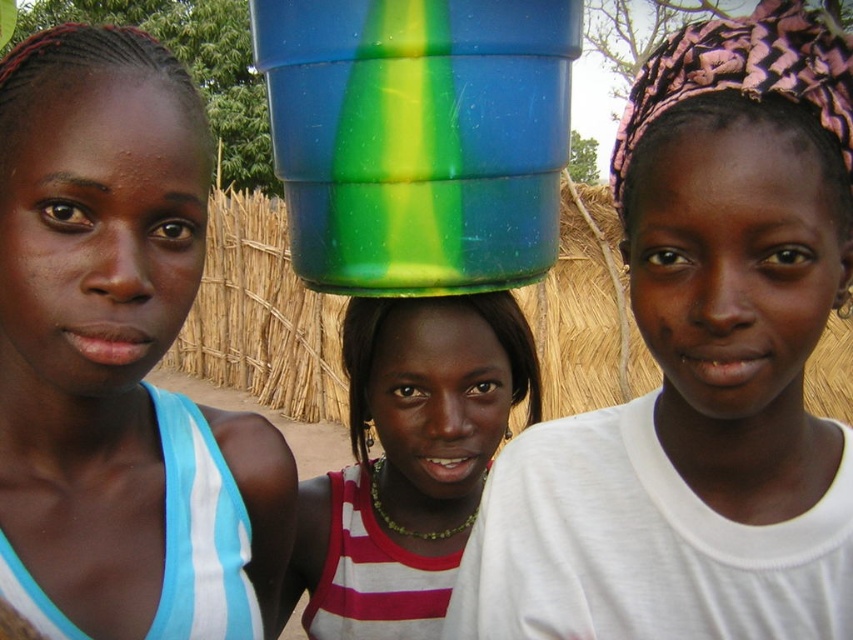
Looking at this image, does matte plastic bucket at upper center have a smaller size compared to green translucent bucket at center?

Yes, matte plastic bucket at upper center is smaller than green translucent bucket at center.

Does matte plastic bucket at upper center have a greater width compared to green translucent bucket at center?

No.

Is point (820, 152) more distant than point (503, 292)?

No, it is in front of (503, 292).

Where is `matte plastic bucket at upper center`? This screenshot has height=640, width=853. matte plastic bucket at upper center is located at coordinates (699, 371).

Can you confirm if matte plastic bucket at upper center is thinner than green plastic bucket at center?

Indeed, matte plastic bucket at upper center has a lesser width compared to green plastic bucket at center.

The height and width of the screenshot is (640, 853). Describe the element at coordinates (699, 371) in the screenshot. I see `matte plastic bucket at upper center` at that location.

Locate an element on the screen. This screenshot has height=640, width=853. matte plastic bucket at upper center is located at coordinates (699, 371).

Between matte blue tank top at left and green plastic bucket at center, which one appears on the right side from the viewer's perspective?

From the viewer's perspective, green plastic bucket at center appears more on the right side.

Who is lower down, matte blue tank top at left or green plastic bucket at center?

green plastic bucket at center is lower down.

Is point (164, 477) closer to viewer compared to point (489, 458)?

Yes.

Find the location of a particular element. This screenshot has width=853, height=640. matte blue tank top at left is located at coordinates (94, 312).